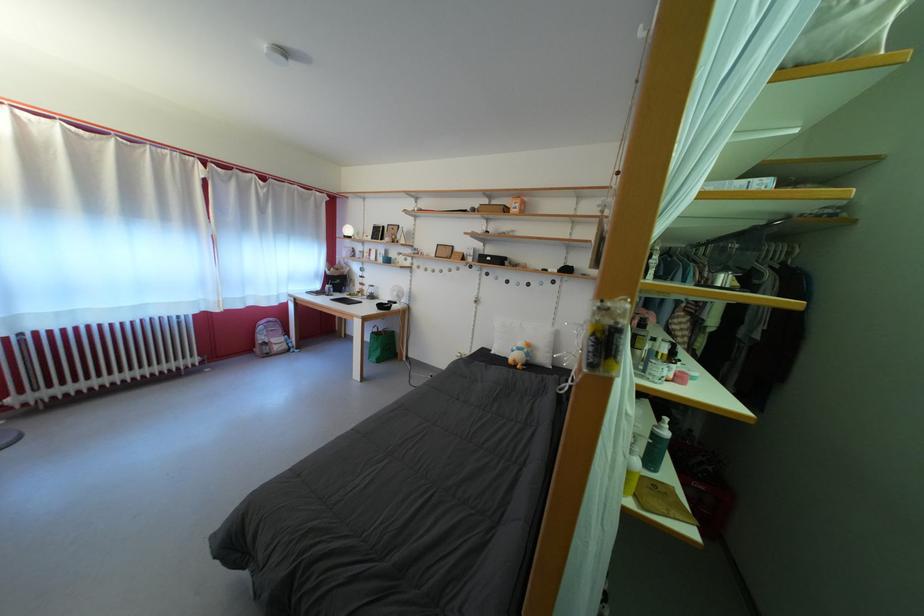
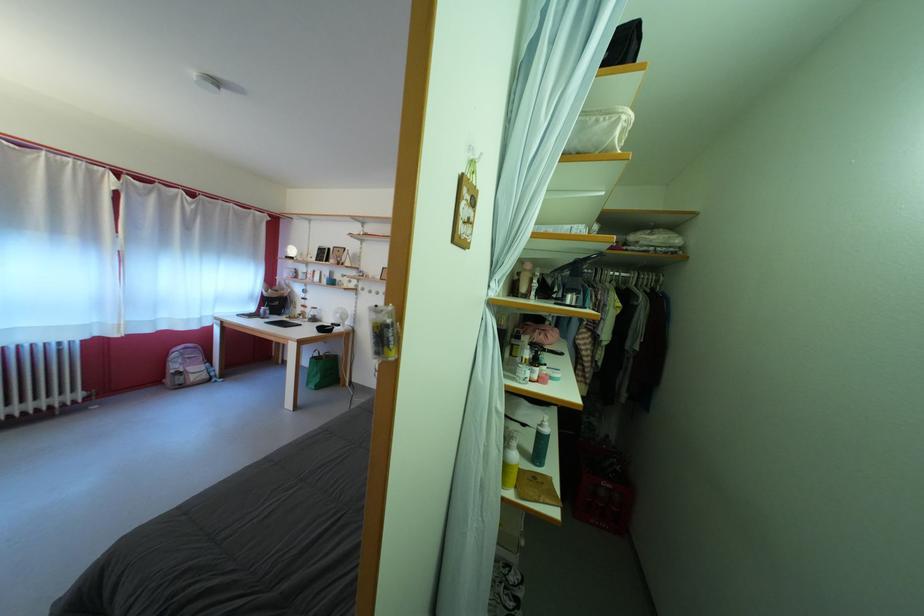
The point at (271, 344) is marked in the first image. Where is the corresponding point in the second image?

(184, 373)